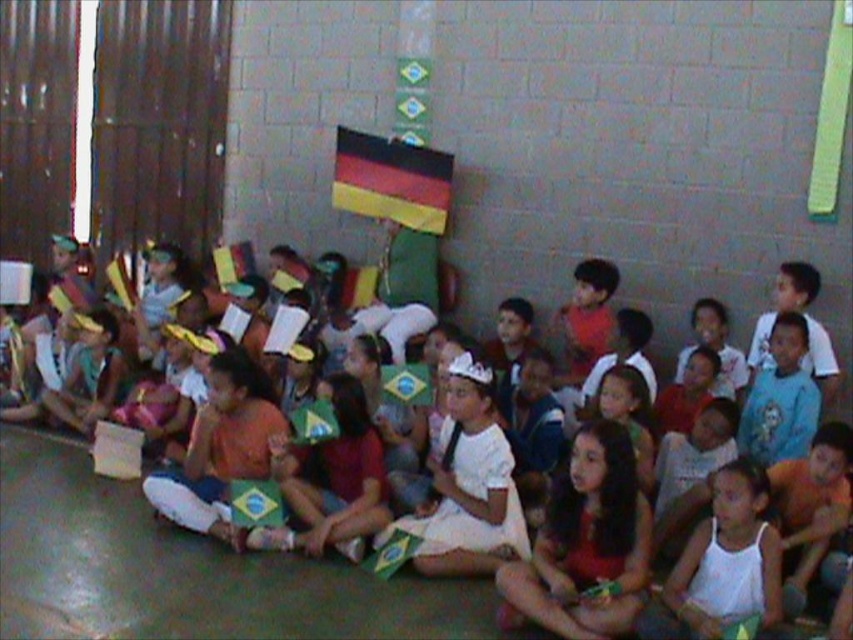
Question: Is white paper hat at center below yellow-green-red striped flag at center?

Choices:
 (A) yes
 (B) no

Answer: (A)

Question: Does white paper hat at center lie behind yellow-green-red striped flag at center?

Choices:
 (A) no
 (B) yes

Answer: (A)

Question: Among these objects, which one is nearest to the camera?

Choices:
 (A) white paper hat at center
 (B) yellow-green-red striped flag at center

Answer: (A)

Question: Which object appears farthest from the camera in this image?

Choices:
 (A) white paper hat at center
 (B) yellow-green-red striped flag at center

Answer: (B)

Question: Is white paper hat at center further to the viewer compared to yellow-green-red striped flag at center?

Choices:
 (A) yes
 (B) no

Answer: (B)